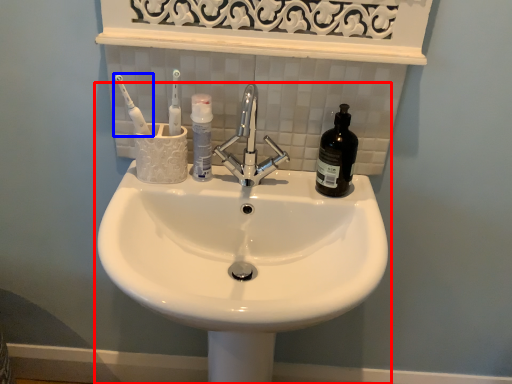
Question: Among these objects, which one is nearest to the camera, sink (highlighted by a red box) or toothbrush (highlighted by a blue box)?

Choices:
 (A) sink
 (B) toothbrush

Answer: (A)